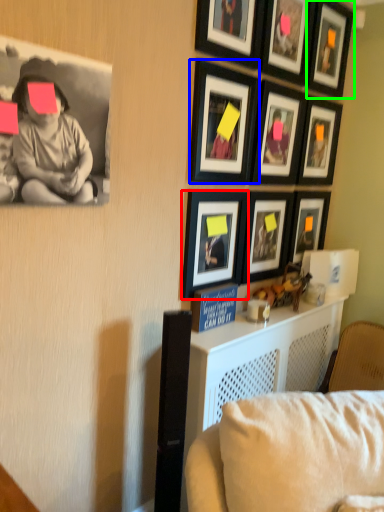
Question: Estimate the real-world distances between objects in this image. Which object is farther from picture frame (highlighted by a red box), picture frame (highlighted by a blue box) or picture frame (highlighted by a green box)?

Choices:
 (A) picture frame
 (B) picture frame

Answer: (B)